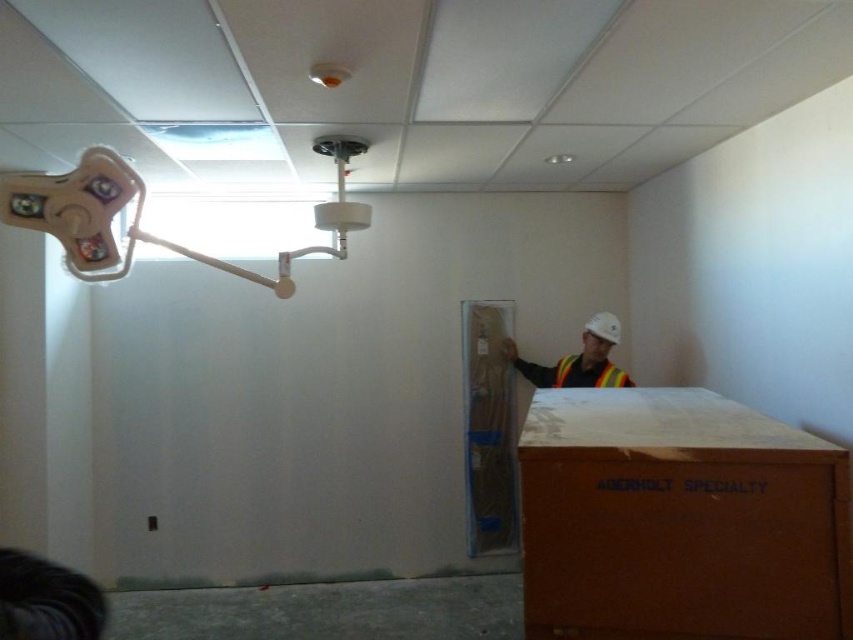
Question: Which of the following is the farthest from the observer?

Choices:
 (A) white plastic light fixture at upper left
 (B) reflective safety vest at center
 (C) brown cardboard box at lower right

Answer: (B)

Question: Does brown cardboard box at lower right appear over reflective safety vest at center?

Choices:
 (A) yes
 (B) no

Answer: (B)

Question: In this image, where is brown cardboard box at lower right located relative to white plastic light fixture at upper left?

Choices:
 (A) right
 (B) left

Answer: (A)

Question: Does brown cardboard box at lower right come in front of white plastic light fixture at upper left?

Choices:
 (A) yes
 (B) no

Answer: (B)

Question: Which object is closer to the camera taking this photo?

Choices:
 (A) white plastic light fixture at upper left
 (B) reflective yellow safety vest at center

Answer: (A)

Question: Which object is the closest to the brown cardboard box at lower right?

Choices:
 (A) reflective safety vest at center
 (B) white plastic light fixture at upper left
 (C) reflective yellow safety vest at center

Answer: (B)